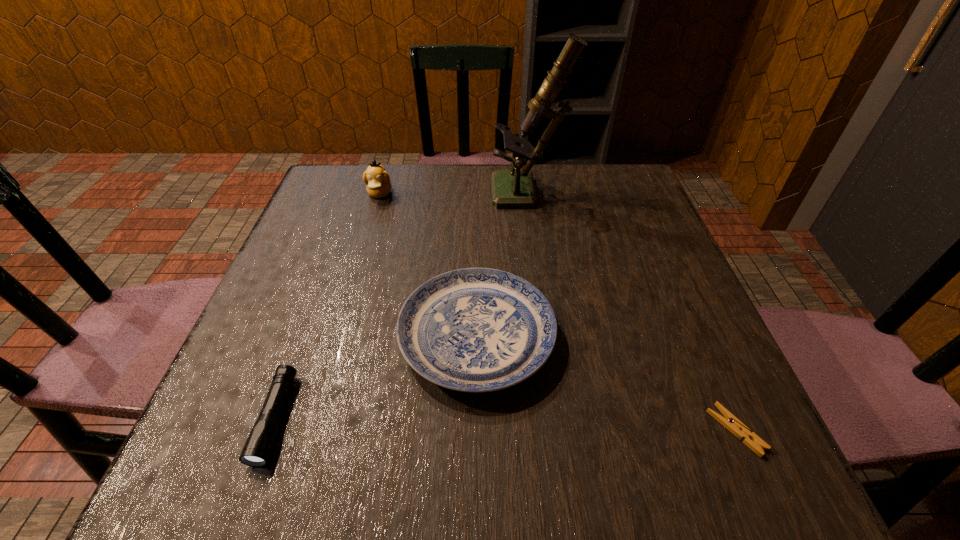
Locate an element on the screen. This screenshot has width=960, height=540. empty space that is in between the plate and the second object from left to right is located at coordinates (428, 265).

Where is `object that is the third closest to the plate`? This screenshot has height=540, width=960. object that is the third closest to the plate is located at coordinates (729, 421).

Identify the location of object identified as the second closest to the flashlight. (377, 179).

I want to click on free space that satisfies the following two spatial constraints: 1. on the face of the fourth shortest object; 2. on the left side of the rightmost object, so click(311, 430).

The image size is (960, 540). Find the location of `free space in the image that satisfies the following two spatial constraints: 1. on the face of the rightmost object; 2. on the right side of the second object from left to right`. free space in the image that satisfies the following two spatial constraints: 1. on the face of the rightmost object; 2. on the right side of the second object from left to right is located at coordinates (311, 430).

Where is `vacant region that satisfies the following two spatial constraints: 1. on the face of the second tallest object; 2. on the left side of the plate`? The width and height of the screenshot is (960, 540). vacant region that satisfies the following two spatial constraints: 1. on the face of the second tallest object; 2. on the left side of the plate is located at coordinates (338, 336).

Find the location of a particular element. vacant space that satisfies the following two spatial constraints: 1. at the eyepiece of the microscope; 2. on the back side of the rightmost object is located at coordinates (563, 430).